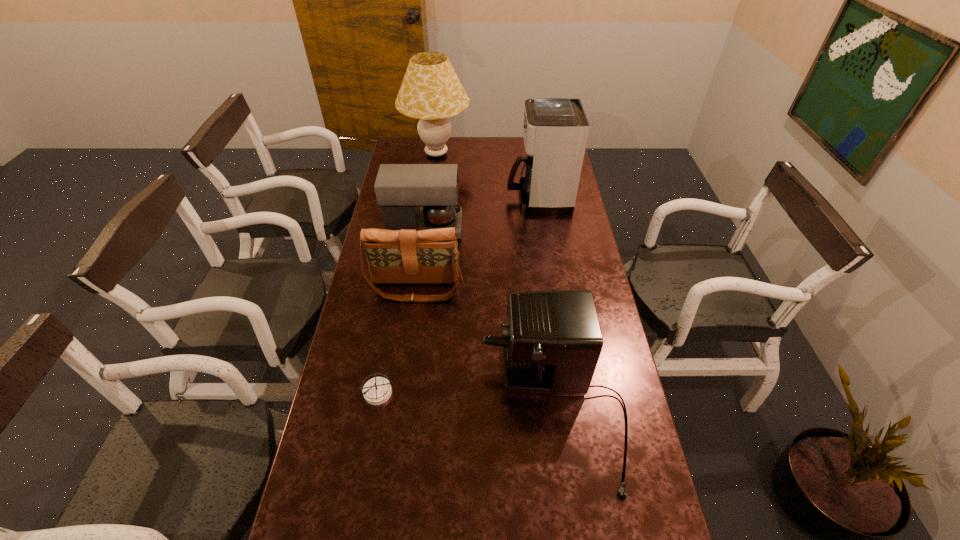
Image resolution: width=960 pixels, height=540 pixels. I want to click on free space between the second farthest object and the second farthest coffee maker, so click(x=481, y=213).

Find the location of a particular element. This screenshot has width=960, height=540. free space between the compass and the second nearest coffee maker is located at coordinates (401, 309).

This screenshot has width=960, height=540. In order to click on empty space between the compass and the farthest coffee maker in this screenshot , I will do `click(458, 295)`.

Identify the location of free space between the compass and the fifth nearest object. Image resolution: width=960 pixels, height=540 pixels. (458, 295).

Locate an element on the screen. object that is the fifth closest to the third nearest object is located at coordinates (431, 91).

This screenshot has height=540, width=960. What are the coordinates of `object that can be found as the fifth closest to the nearest coffee maker` in the screenshot? It's located at (431, 91).

The width and height of the screenshot is (960, 540). I want to click on coffee maker that can be found as the third closest to the shortest object, so click(555, 130).

The height and width of the screenshot is (540, 960). In order to click on coffee maker identified as the second closest to the nearest coffee maker in this screenshot , I will do `click(555, 130)`.

Where is `vacant space that satisfies the following two spatial constraints: 1. on the back side of the shortest object; 2. on the right side of the lampshade`? vacant space that satisfies the following two spatial constraints: 1. on the back side of the shortest object; 2. on the right side of the lampshade is located at coordinates (420, 153).

Find the location of a particular element. vacant space that satisfies the following two spatial constraints: 1. on the carafe side of the fourth nearest object; 2. on the front side of the shortest object is located at coordinates (401, 392).